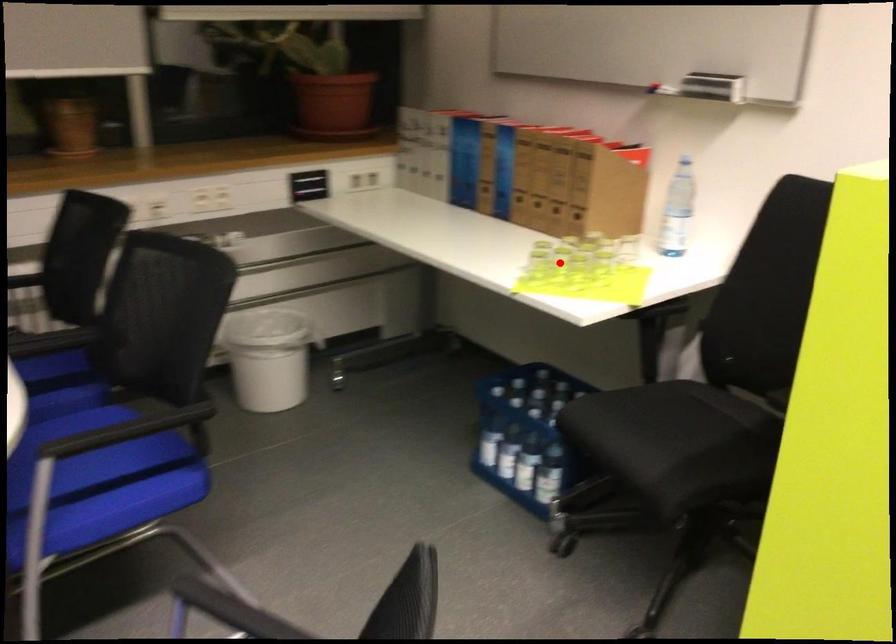
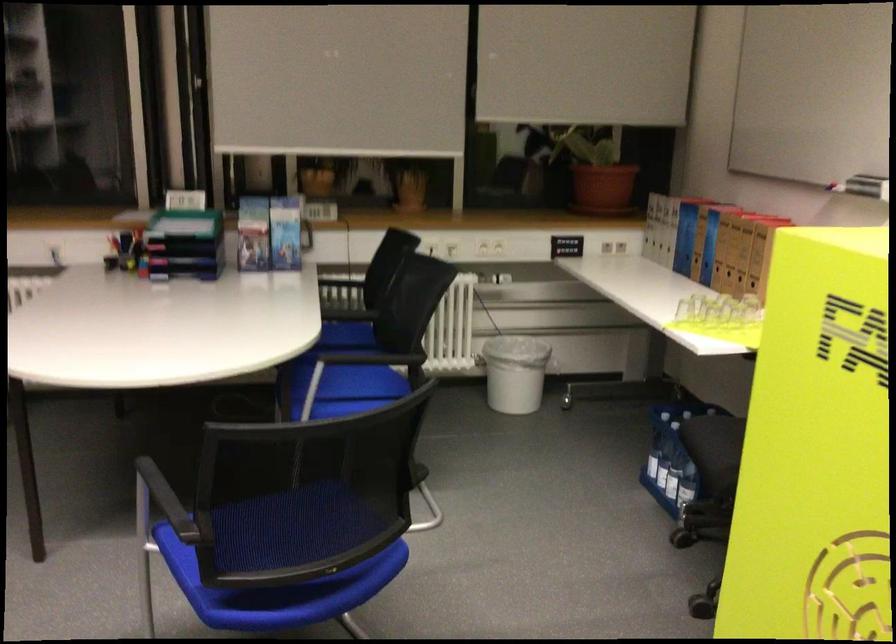
Locate, in the second image, the point that corresponds to the highlighted location in the first image.

(713, 310)